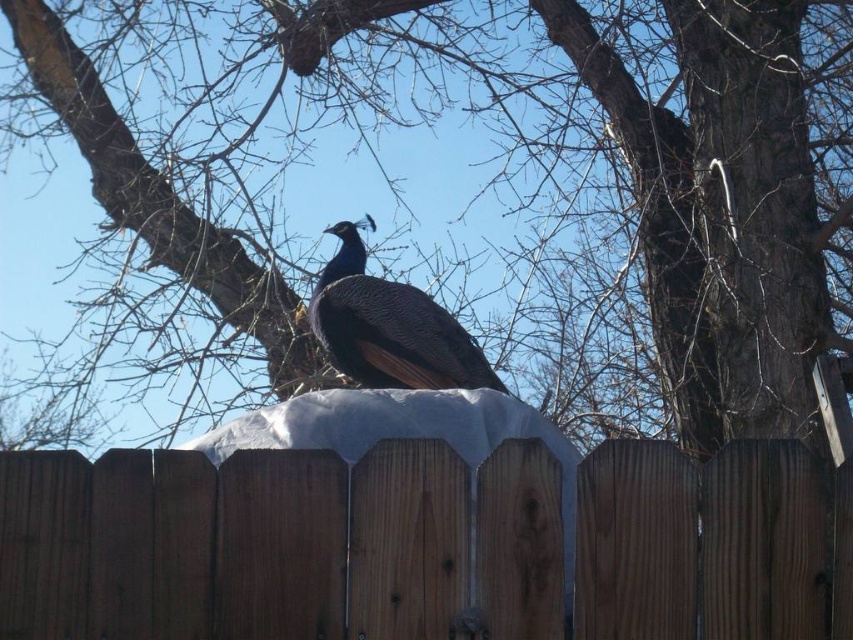
You are a photographer trying to capture the shiny blue peacock at center. You notice the brown wooden fence at center in the background. From the peacock, which direction should you move to avoid the fence appearing in your shot?

The brown wooden fence at center is positioned on the right side of the shiny blue peacock at center. To avoid the fence appearing in the shot, move to the left of the peacock.

You are a photographer trying to capture a closeup of the shiny blue peacock at center. You are currently standing 1.5 meters away from the brown wood tree at upper center. Can you get a clear shot of the peacock without moving closer to it?

The distance between the brown wood tree at upper center and the shiny blue peacock at center is 2.16 meters. Since you are 1.5 meters away from the tree, you are still 0.66 meters away from the peacock. Therefore, you can get a clear shot without moving closer.

You are a photographer trying to capture the shiny blue peacock at center perched on the brown wooden fence at center. Do you think the peacock will be fully visible above the fence in your photo?

The shiny blue peacock at center is taller than the brown wooden fence at center, so yes, the peacock will be fully visible above the fence in your photo.